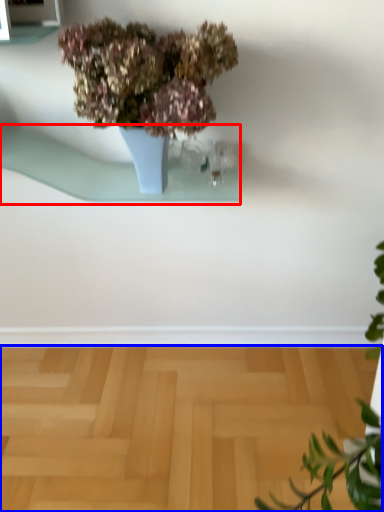
Question: Which point is closer to the camera, window sill (highlighted by a red box) or surface (highlighted by a blue box)?

Choices:
 (A) window sill
 (B) surface

Answer: (A)